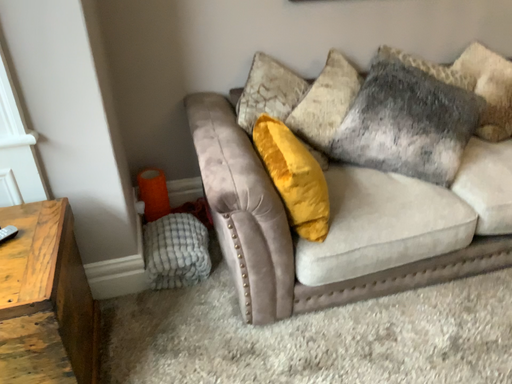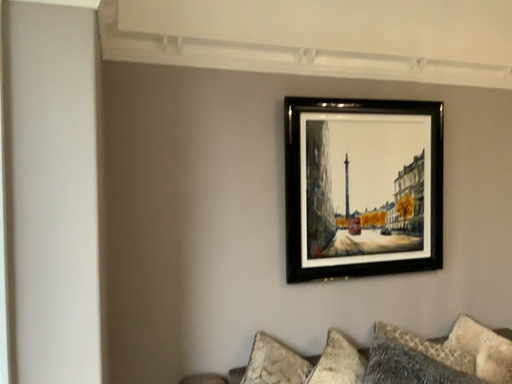
Question: Which way did the camera rotate in the video?

Choices:
 (A) rotated upward
 (B) rotated downward

Answer: (A)